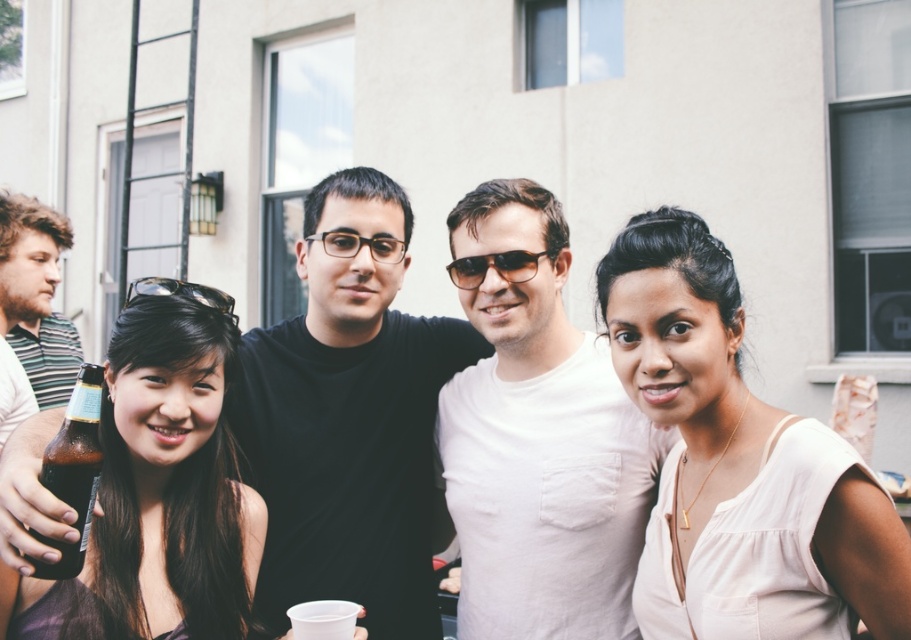
You are at a party and want to hand a drink to the person wearing the black matte shirt at center without disturbing the person in the striped cotton shirt at left. Which direction should you approach from?

The black matte shirt at center is located below the striped cotton shirt at left, so you should approach from the bottom to avoid disturbing the person in the striped cotton shirt at left.